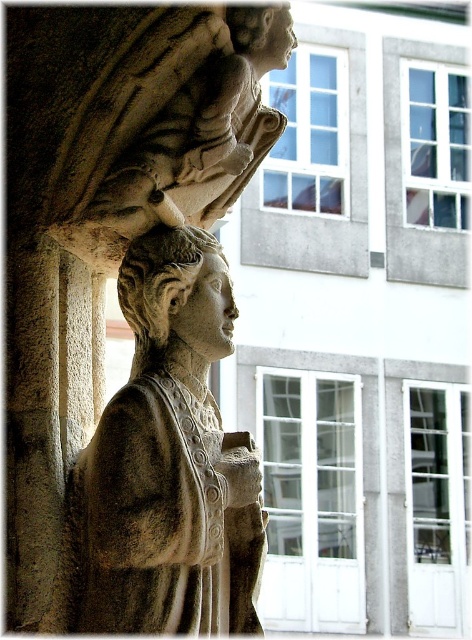
Is gray stone statue at center shorter than smooth stone head at upper center?

No, gray stone statue at center is not shorter than smooth stone head at upper center.

Looking at this image, does gray stone statue at center have a greater width compared to smooth stone head at upper center?

Yes.

Where is `gray stone statue at center`? gray stone statue at center is located at coordinates (168, 461).

Is gray stone statue at center to the left of gray stone head at center from the viewer's perspective?

In fact, gray stone statue at center is to the right of gray stone head at center.

Does gray stone statue at center appear on the right side of gray stone head at center?

Correct, you'll find gray stone statue at center to the right of gray stone head at center.

Is point (124, 518) farther from camera compared to point (210, 236)?

No, (124, 518) is closer to viewer.

Where is `gray stone statue at center`? Image resolution: width=472 pixels, height=640 pixels. gray stone statue at center is located at coordinates (168, 461).

Does gray stone head at center have a larger size compared to smooth stone head at upper center?

Yes.

Which is below, gray stone head at center or smooth stone head at upper center?

gray stone head at center

Does point (197, 264) come closer to viewer compared to point (275, 4)?

Yes, it is.

This screenshot has height=640, width=472. What are the coordinates of `gray stone head at center` in the screenshot? It's located at (160, 280).